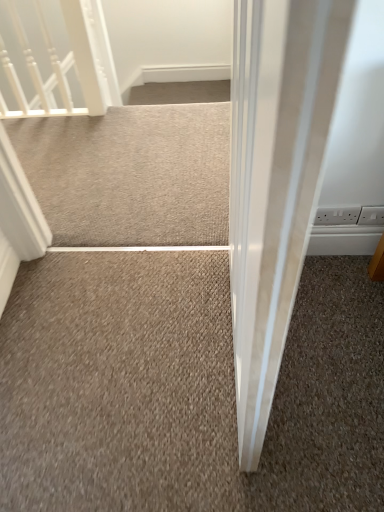
Question: Does point (59, 182) appear closer or farther from the camera than point (377, 222)?

Choices:
 (A) farther
 (B) closer

Answer: (A)

Question: From a real-world perspective, is beige carpet at center positioned above or below white plastic electric outlet at right, the 2th electric outlet from the left?

Choices:
 (A) below
 (B) above

Answer: (A)

Question: Based on their relative distances, which object is farther from the white glossy rail at upper left?

Choices:
 (A) white plastic electric outlet at upper right, acting as the first electric outlet starting from the left
 (B) beige carpet at center
 (C) white plastic electric outlet at right, the 2th electric outlet from the left

Answer: (C)

Question: Which object is the closest to the beige carpet at center?

Choices:
 (A) white plastic electric outlet at right, the 2th electric outlet from the left
 (B) white glossy rail at upper left
 (C) white plastic electric outlet at upper right, which ranks as the 2th electric outlet in right-to-left order

Answer: (B)